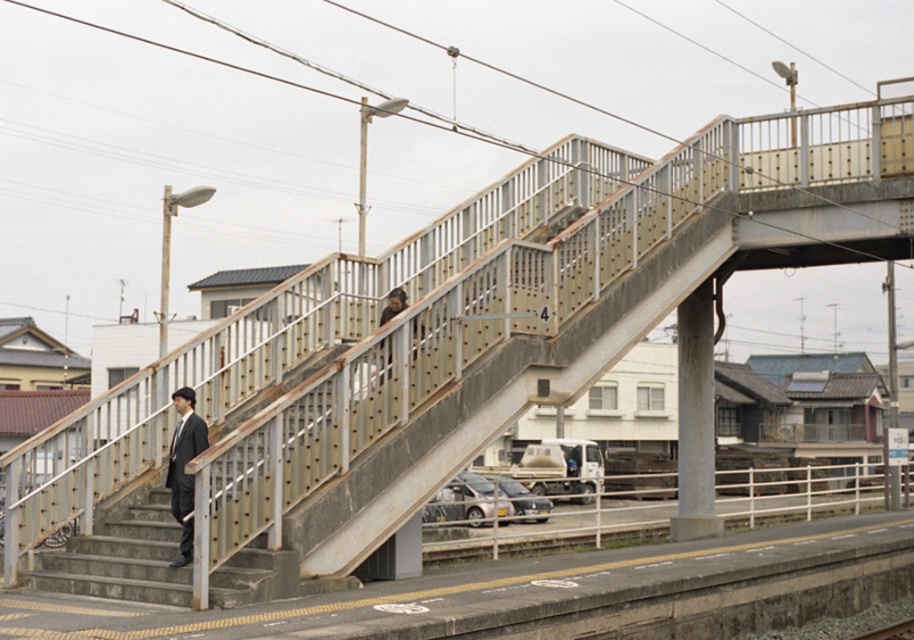
Question: Which object is the farthest from the rusty metal stairs at lower left?

Choices:
 (A) dark gray suit at left
 (B) dark brown leather jacket at center

Answer: (B)

Question: Does rusty metal stairs at lower left come behind dark brown leather jacket at center?

Choices:
 (A) yes
 (B) no

Answer: (B)

Question: Does rusty metal stairs at lower left appear over dark gray suit at left?

Choices:
 (A) no
 (B) yes

Answer: (A)

Question: Which object is positioned closest to the rusty metal stairs at lower left?

Choices:
 (A) dark gray suit at left
 (B) dark brown leather jacket at center

Answer: (A)

Question: Among these objects, which one is nearest to the camera?

Choices:
 (A) dark gray suit at left
 (B) rusty metal stairs at lower left

Answer: (B)

Question: Does rusty metal stairs at lower left appear under dark brown leather jacket at center?

Choices:
 (A) no
 (B) yes

Answer: (B)